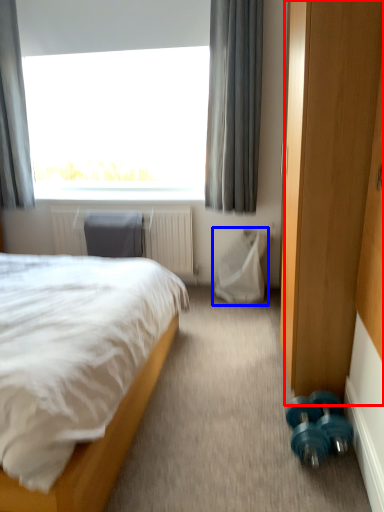
Question: Which object appears closest to the camera in this image, screen door (highlighted by a red box) or swivel chair (highlighted by a blue box)?

Choices:
 (A) screen door
 (B) swivel chair

Answer: (A)